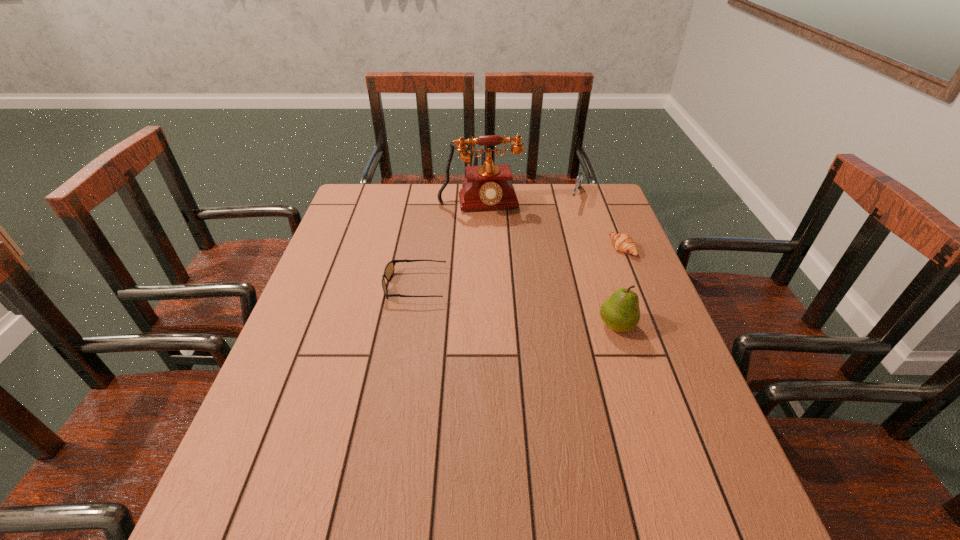
The height and width of the screenshot is (540, 960). Identify the location of the second nearest object. (389, 270).

You are a GUI agent. You are given a task and a screenshot of the screen. Output one action in this format:
    pyautogui.click(x=<x>, y=<y>)
    Task: Click on the second tallest object
    The width and height of the screenshot is (960, 540).
    Given the screenshot: What is the action you would take?
    pyautogui.click(x=620, y=312)

This screenshot has height=540, width=960. In order to click on pear in this screenshot , I will do `click(620, 312)`.

The width and height of the screenshot is (960, 540). Find the location of `telephone`. telephone is located at coordinates pyautogui.click(x=489, y=186).

Identify the location of pastry. The width and height of the screenshot is (960, 540). (622, 242).

What are the coordinates of `the rightmost object` in the screenshot? It's located at (622, 242).

Image resolution: width=960 pixels, height=540 pixels. Identify the location of pistol. (579, 178).

Locate an element on the screen. The image size is (960, 540). free spot located on the front-facing side of the second nearest object is located at coordinates (350, 286).

You are a GUI agent. You are given a task and a screenshot of the screen. Output one action in this format:
    pyautogui.click(x=<x>, y=<y>)
    Task: Click on the free space located 0.180m on the front-facing side of the second nearest object
    This screenshot has height=540, width=960.
    Given the screenshot: What is the action you would take?
    pyautogui.click(x=317, y=286)

This screenshot has height=540, width=960. Identify the location of vacant space located on the left of the nearest object. coord(447,326).